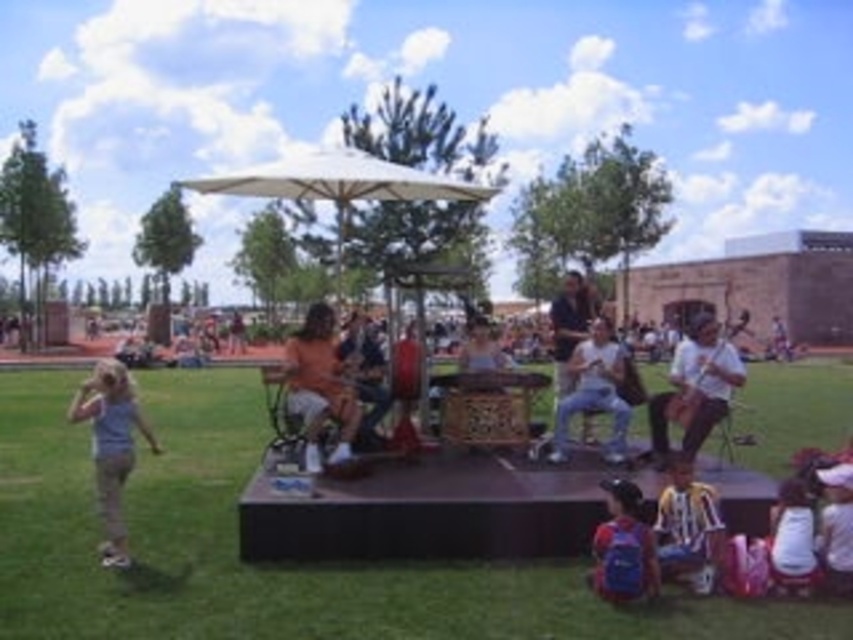
You are standing at the edge of the stage and want to reach the light blue fabric at lower left. Based on the distance provided, can you estimate how many steps you would need to take to reach it? Assume each step covers approximately 3 feet.

The light blue fabric at lower left is 24.84 feet away from the viewer. If each step covers about 3 feet, dividing 24.84 by 3 gives approximately 8.28 steps. Since you can only take whole steps, you would need to take around 8 or 9 steps to reach the light blue fabric at lower left.

Looking at this image, you are an event organizer who needs to set up a banner. You have a light blue fabric at lower left and an orange fabric at center. Which fabric has a larger width to use as a banner?

The light blue fabric at lower left might be wider than orange fabric at center, so it is more suitable for the banner.